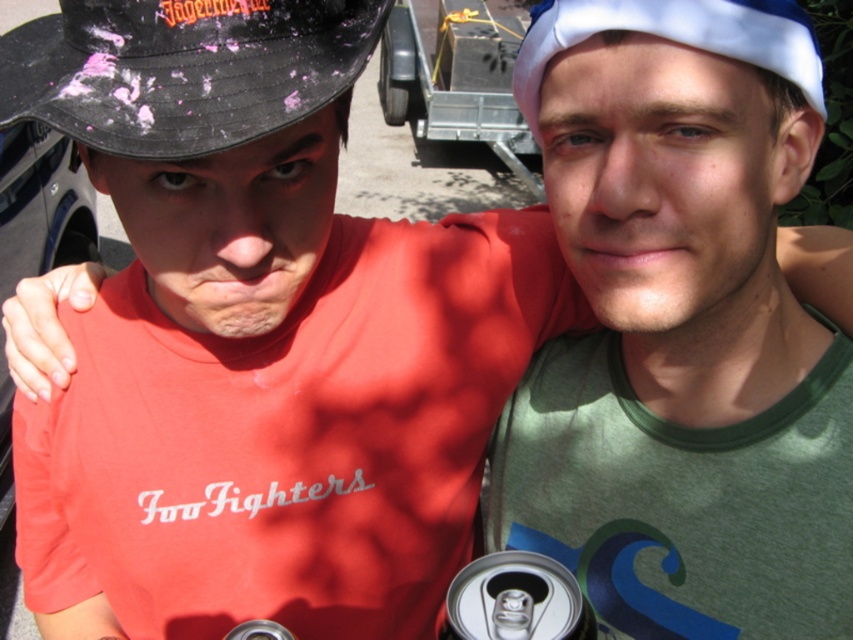
Question: Which point is farther to the camera?

Choices:
 (A) metallic silver can at lower center
 (B) white fabric baseball cap at upper right
 (C) black matte baseball hat at left

Answer: (A)

Question: Is black matte baseball hat at left to the left of white fabric baseball cap at upper right from the viewer's perspective?

Choices:
 (A) no
 (B) yes

Answer: (B)

Question: Which point is farther to the camera?

Choices:
 (A) silver metallic can at lower center
 (B) metallic silver can at lower center
 (C) white fabric baseball cap at upper right
 (D) black matte baseball hat at left

Answer: (B)

Question: Does black matte baseball hat at left have a lesser width compared to white fabric baseball cap at upper right?

Choices:
 (A) yes
 (B) no

Answer: (B)

Question: Which of the following is the farthest from the observer?

Choices:
 (A) silver metallic can at lower center
 (B) white fabric baseball cap at upper right
 (C) metallic silver can at lower center

Answer: (C)

Question: Is silver metallic can at lower center to the left of metallic silver can at lower center from the viewer's perspective?

Choices:
 (A) yes
 (B) no

Answer: (B)